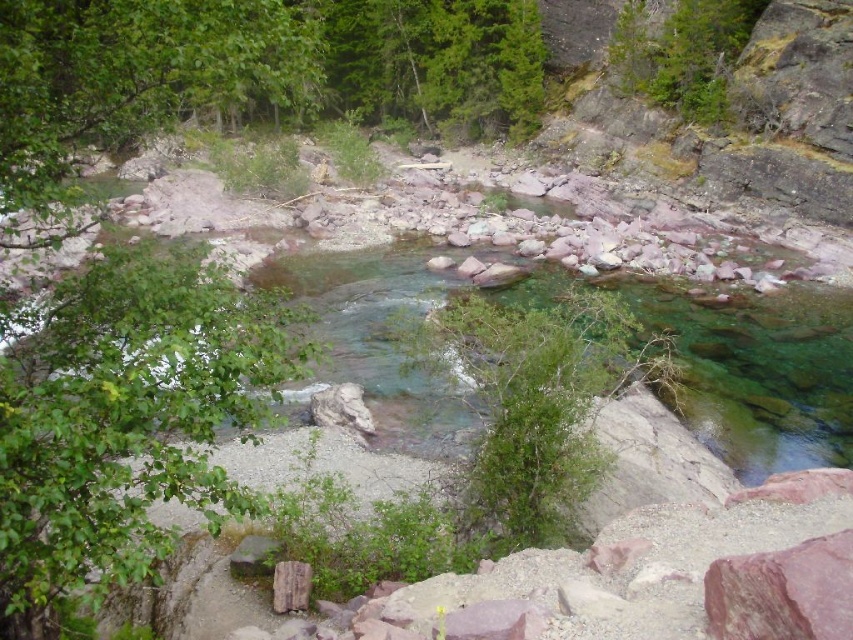
Question: Is the position of green leafy bush at center less distant than that of brown rough stone at center?

Choices:
 (A) no
 (B) yes

Answer: (B)

Question: Does green leafy bush at center lie behind brown rough stone at center?

Choices:
 (A) no
 (B) yes

Answer: (A)

Question: Can you confirm if green leafy bush at center is positioned below brown rough stone at center?

Choices:
 (A) no
 (B) yes

Answer: (A)

Question: Which object appears farthest from the camera in this image?

Choices:
 (A) brown rough stone at center
 (B) green leafy bush at center

Answer: (A)

Question: Which of the following is the closest to the observer?

Choices:
 (A) (573, 300)
 (B) (294, 593)

Answer: (B)

Question: Which of the following is the closest to the observer?

Choices:
 (A) (300, 561)
 (B) (647, 353)

Answer: (A)